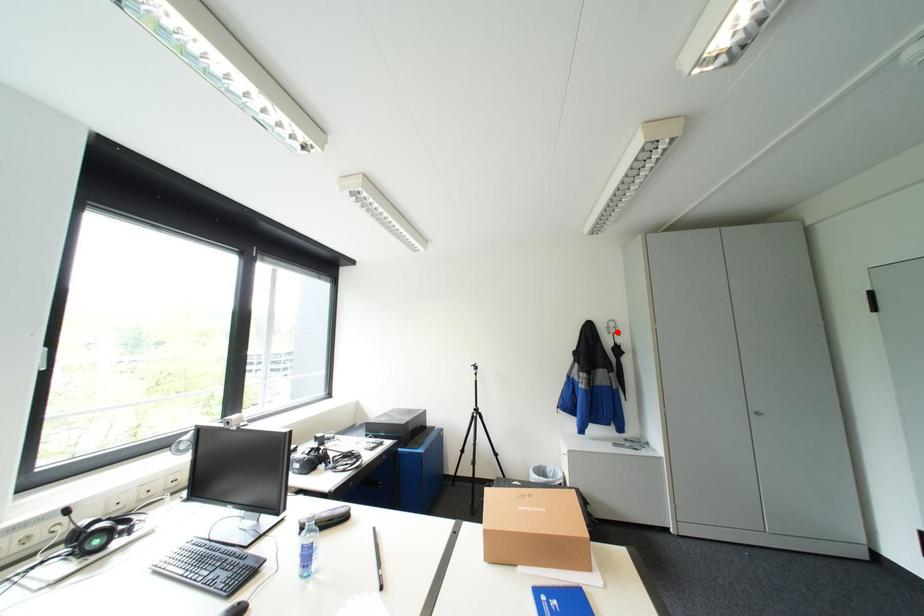
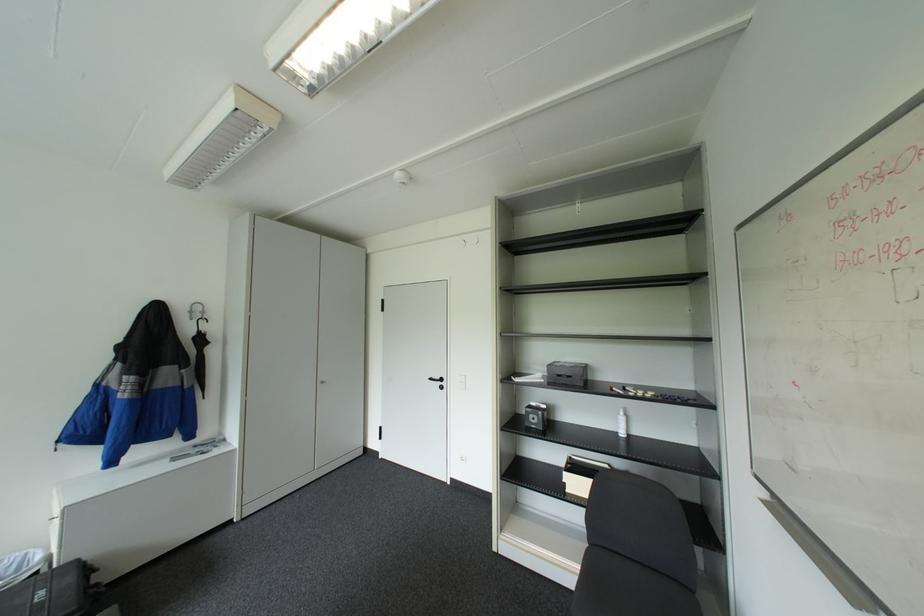
Where in the second image is the point corresponding to the highlighted location from the first image?

(200, 318)